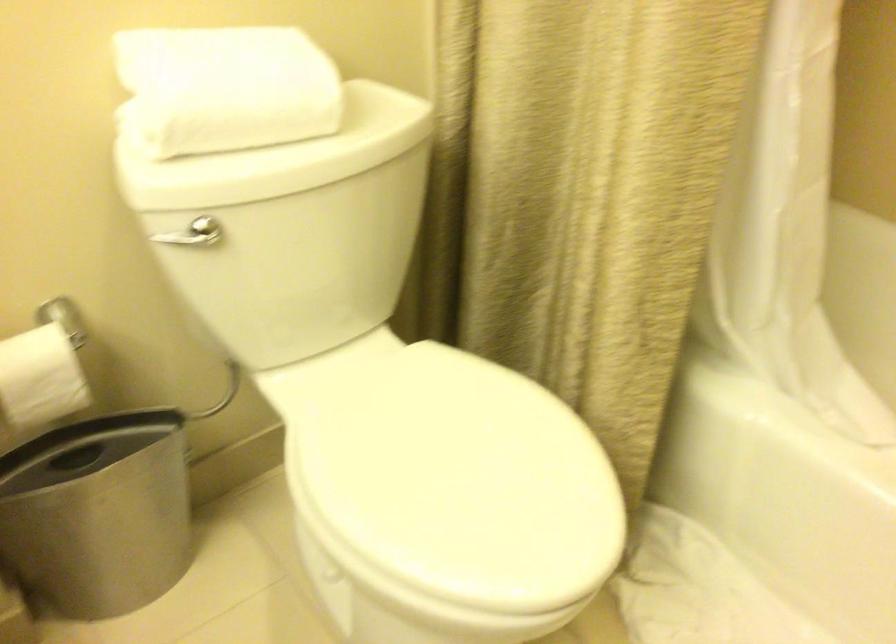
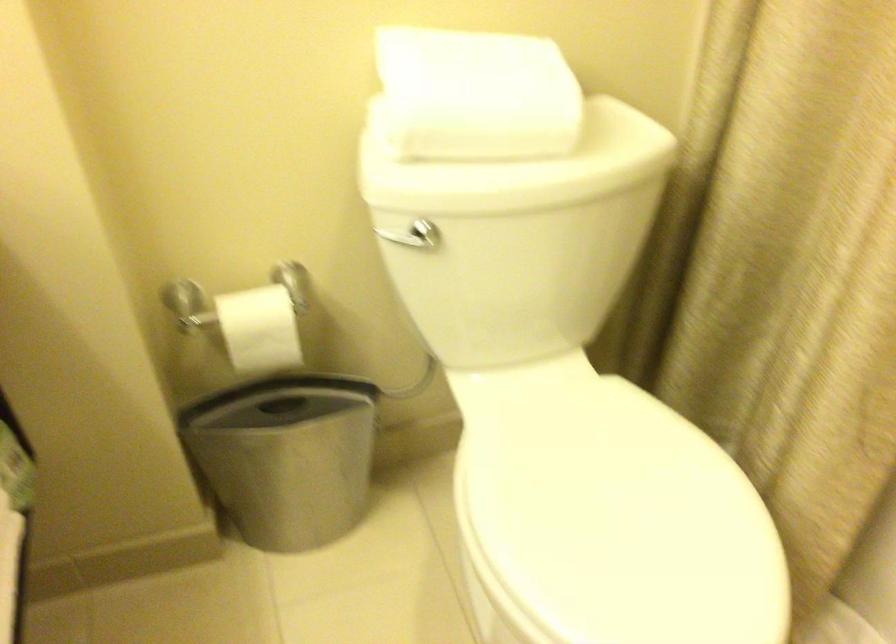
The point at [455,468] is marked in the first image. Where is the corresponding point in the second image?

(613, 518)